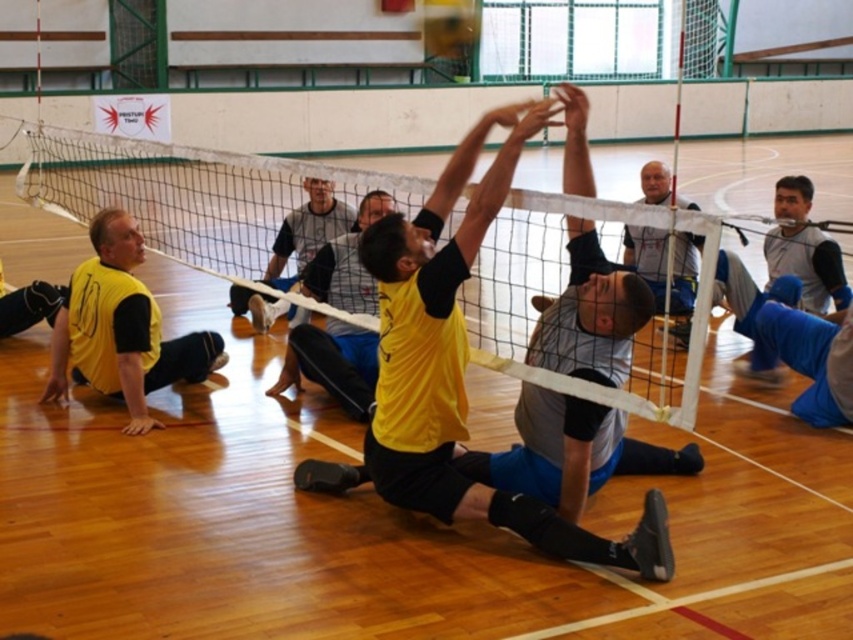
You are a volleyball player standing on the court. You notice the white mesh net at center and the matte black shorts at upper center. Which object is positioned higher from the ground?

The matte black shorts at upper center are positioned higher from the ground than the white mesh net at center.

You are a volleyball coach observing the game. You notice the white mesh net at center and the gray fabric shirt at center. Which object has a greater width in the image?

The white mesh net at center has a greater width than the gray fabric shirt at center.

You are a player in the volleyball game and need to move from the point at coordinates point [160,156] to the point at coordinates point [287,284]. Which direction should you move to reach the destination?

You should move backward because point [160,156] is in front of point [287,284], meaning the destination is behind your current position.